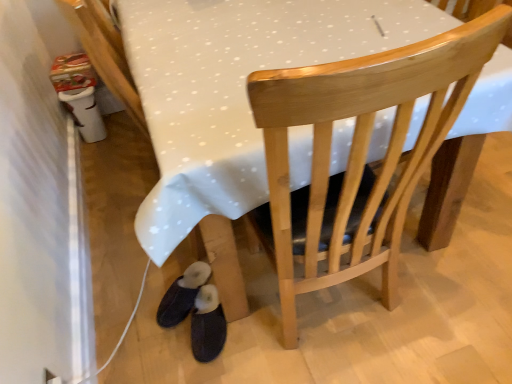
You are a GUI agent. You are given a task and a screenshot of the screen. Output one action in this format:
    pyautogui.click(x=<x>, y=<y>)
    Task: Click on the free area in between dark blue fabric slippers at lower left, marked as the 2th footwear in a left-to-right arrangement, and black suede slippers at lower left, positioned as the first footwear in left-to-right order
    The width and height of the screenshot is (512, 384).
    Given the screenshot: What is the action you would take?
    [182, 342]